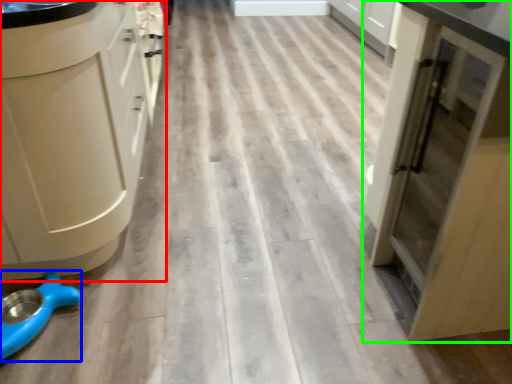
Question: Considering the real-world distances, which object is closest to cabinetry (highlighted by a red box)? appliance (highlighted by a blue box) or cupboard (highlighted by a green box).

Choices:
 (A) appliance
 (B) cupboard

Answer: (A)